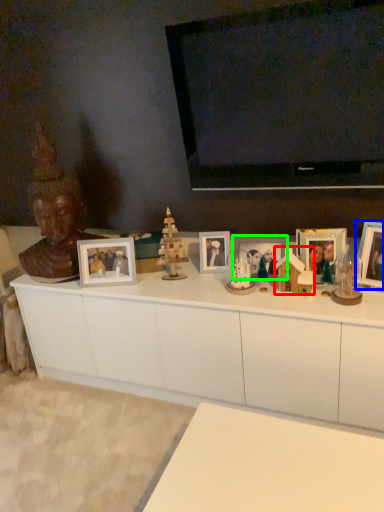
Question: Estimate the real-world distances between objects in this image. Which object is farther from toy (highlighted by a red box), picture frame (highlighted by a blue box) or picture frame (highlighted by a green box)?

Choices:
 (A) picture frame
 (B) picture frame

Answer: (A)